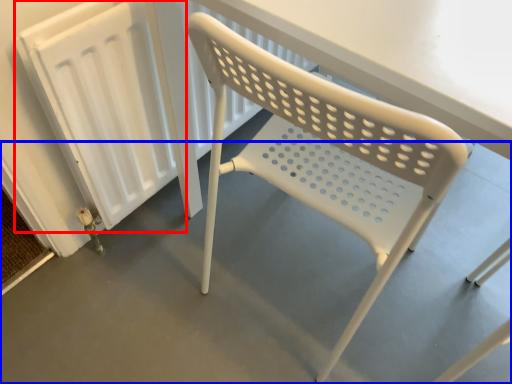
Question: Which of the following is the farthest to the observer, radiator (highlighted by a red box) or concrete (highlighted by a blue box)?

Choices:
 (A) radiator
 (B) concrete

Answer: (A)